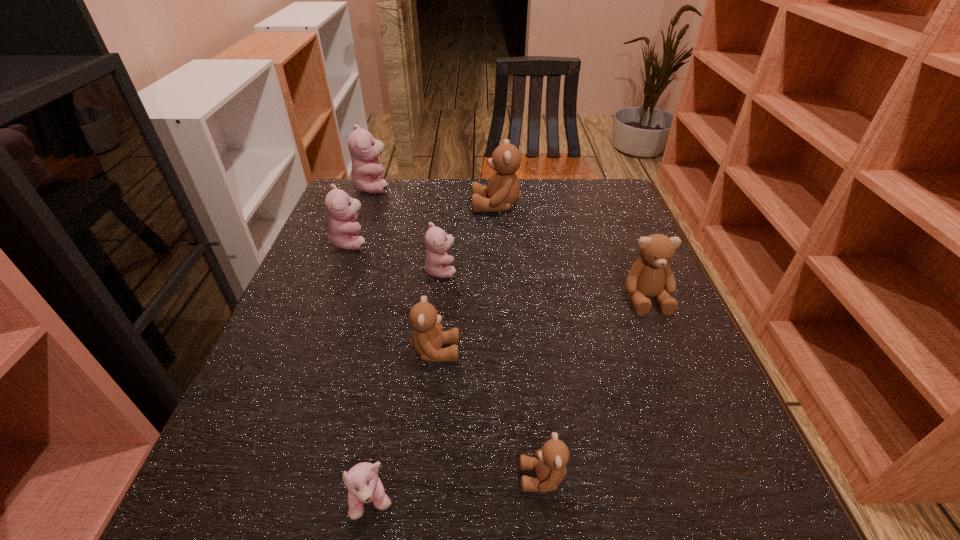
The height and width of the screenshot is (540, 960). Find the location of `the farthest pink teddy bear`. the farthest pink teddy bear is located at coordinates (366, 175).

The width and height of the screenshot is (960, 540). What are the coordinates of `the biggest brown teddy bear` in the screenshot? It's located at (503, 190).

I want to click on the third farthest object, so click(x=344, y=233).

This screenshot has height=540, width=960. I want to click on the sixth nearest teddy bear, so click(344, 233).

This screenshot has width=960, height=540. What are the coordinates of `the third nearest brown teddy bear` in the screenshot? It's located at (651, 275).

The height and width of the screenshot is (540, 960). Identify the location of the rightmost object. (651, 275).

This screenshot has height=540, width=960. I want to click on the third nearest object, so click(x=427, y=338).

Find the location of `the third biggest brown teddy bear`. the third biggest brown teddy bear is located at coordinates (427, 338).

You are a GUI agent. You are given a task and a screenshot of the screen. Output one action in this format:
    pyautogui.click(x=<x>, y=<y>)
    Task: Click on the second smallest pink teddy bear
    This screenshot has width=960, height=540.
    Given the screenshot: What is the action you would take?
    pyautogui.click(x=437, y=242)

Identify the location of the fifth nearest object. coord(437,242).